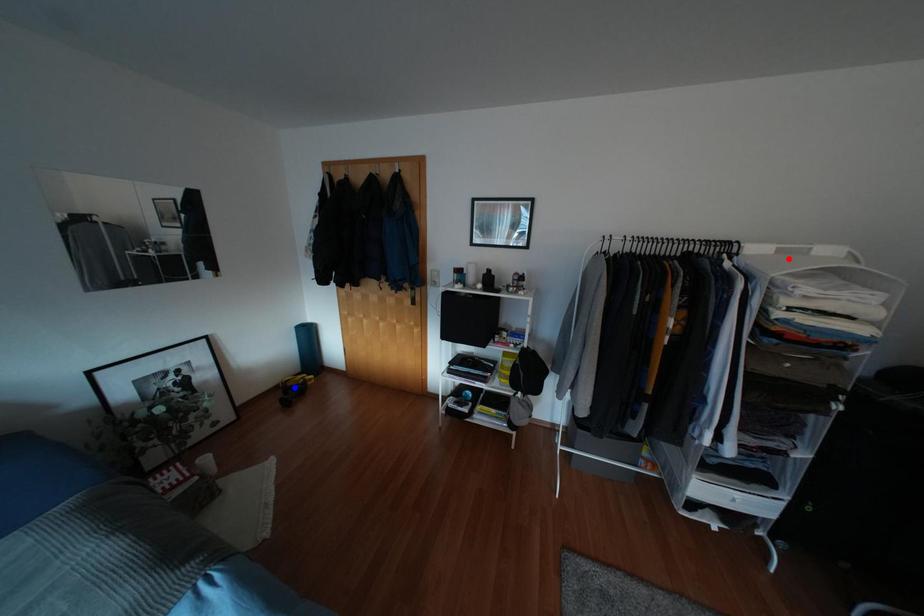
Question: In the image, two points are highlighted. Which point is nearer to the camera? Reply with the corresponding letter.

Choices:
 (A) blue point
 (B) red point

Answer: (B)